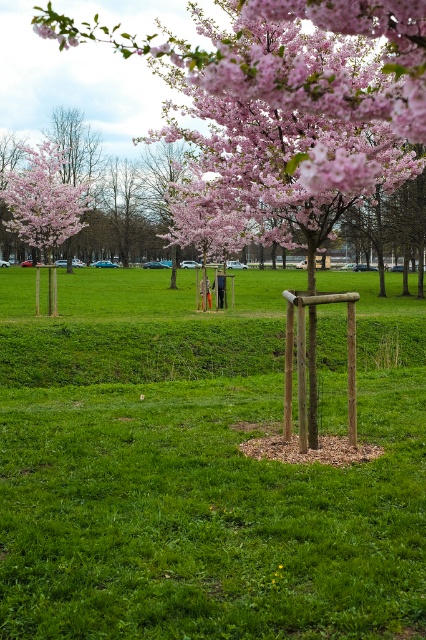
Question: Considering the relative positions of matte pink blossoms at upper left and pink matte flower at upper center in the image provided, where is matte pink blossoms at upper left located with respect to pink matte flower at upper center?

Choices:
 (A) above
 (B) below

Answer: (A)

Question: Which object is positioned closest to the matte pink blossoms at upper left?

Choices:
 (A) pink blossom tree at upper center
 (B) pink matte flower at upper center

Answer: (A)

Question: Is pink blossom tree at upper center smaller than pink matte flower at upper center?

Choices:
 (A) yes
 (B) no

Answer: (B)

Question: Is pink blossom tree at upper center positioned at the back of pink matte flower at upper center?

Choices:
 (A) no
 (B) yes

Answer: (A)

Question: Which point is farther to the camera?

Choices:
 (A) (325, 173)
 (B) (71, 28)
 (C) (42, 221)

Answer: (C)

Question: Which object is positioned closest to the pink blossom tree at upper center?

Choices:
 (A) matte pink blossoms at upper left
 (B) pink matte flower at upper center

Answer: (B)